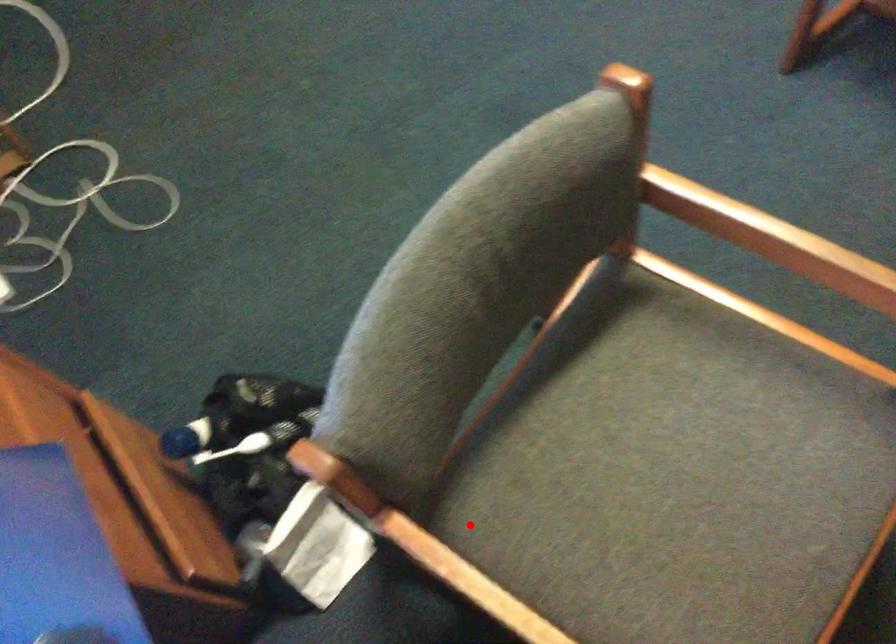
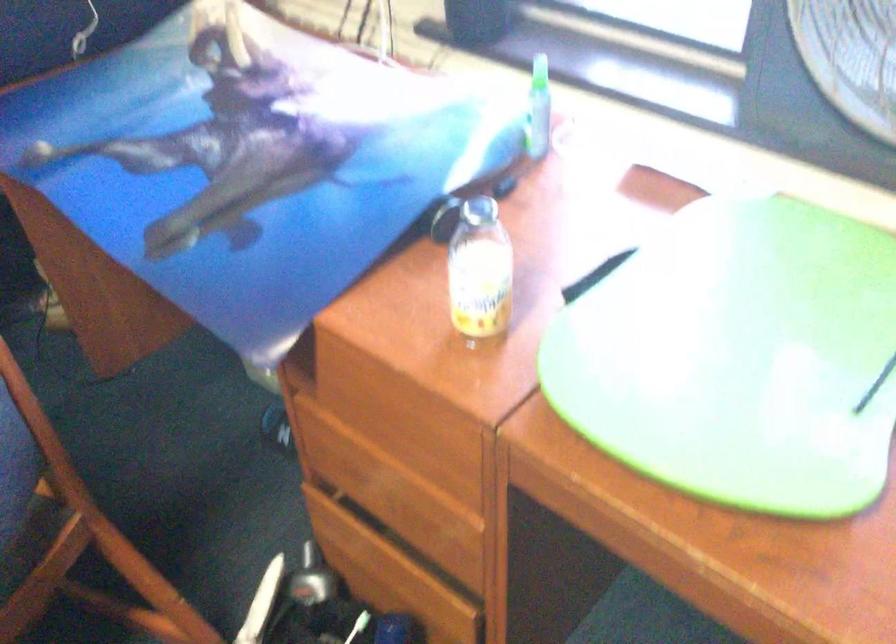
In the second image, find the point that corresponds to the highlighted location in the first image.

(30, 540)